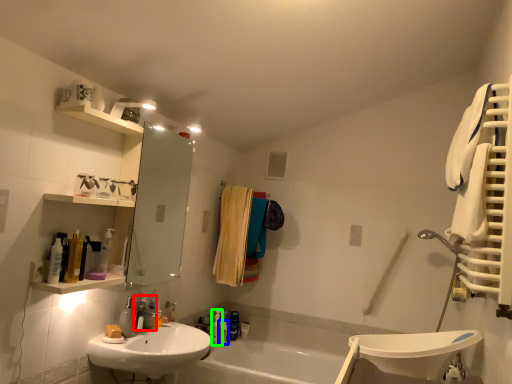
Question: Estimate the real-world distances between objects in this image. Which object is closer to plumbing fixture (highlighted by a red box), toiletry (highlighted by a blue box) or toiletry (highlighted by a green box)?

Choices:
 (A) toiletry
 (B) toiletry

Answer: (B)